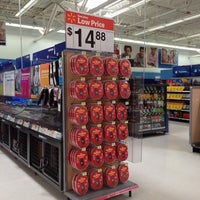
Locate an element on the screen. Image resolution: width=200 pixels, height=200 pixels. side wall is located at coordinates (195, 98).